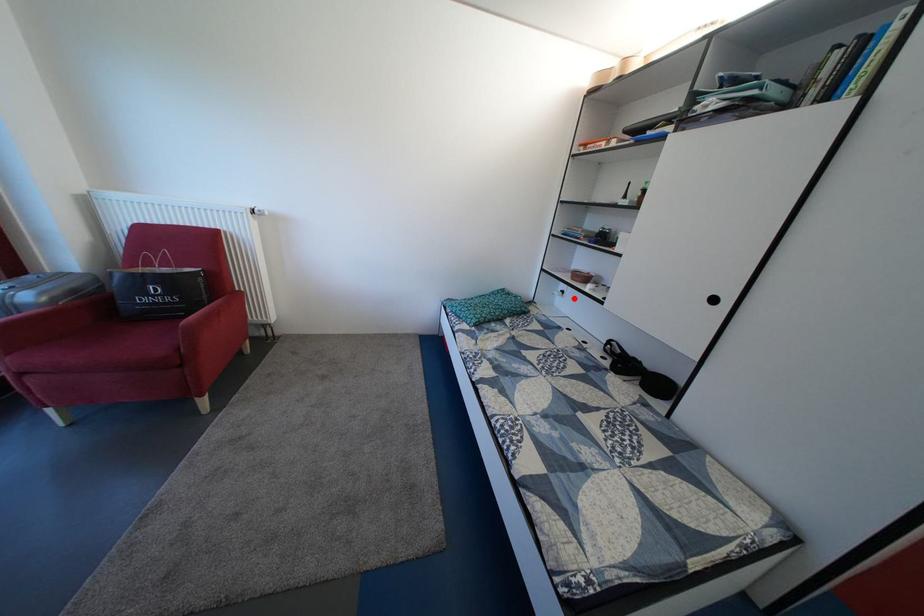
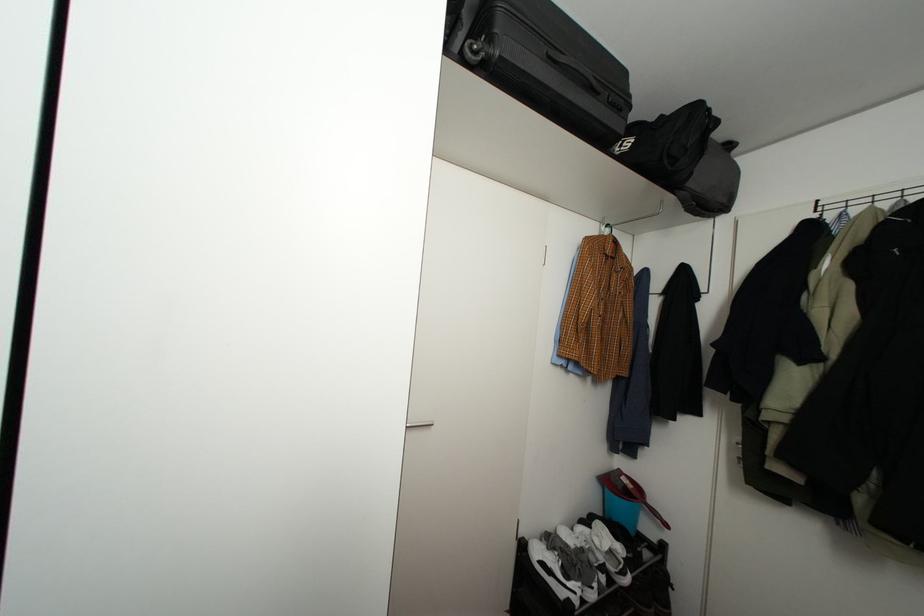
Question: I am providing you with two images of the same scene from different viewpoints. A red point is marked on the first image. At the location where the point appears in image 1, is it still visible in image 2?

Choices:
 (A) Yes
 (B) No

Answer: (B)